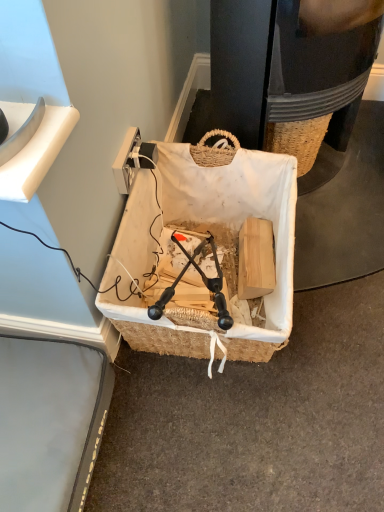
This screenshot has width=384, height=512. I want to click on free spot to the right of woven straw picnic basket at center, so click(337, 270).